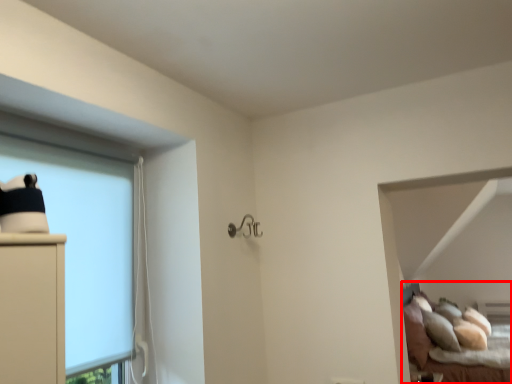
Question: In this image, where is bed (annotated by the red box) located relative to bay window?

Choices:
 (A) left
 (B) right

Answer: (B)